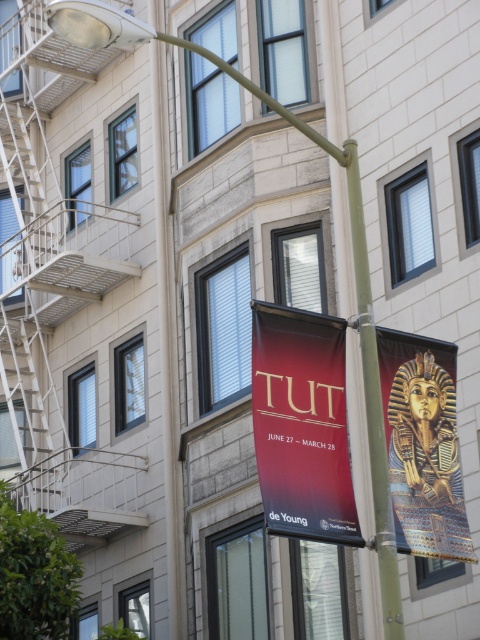
user is a photographer who wants to capture both the matte gold banner at center and the gold metallic pharaoh mask at right in a single frame. Given that the camera can only focus on objects within a 1.5 meter depth range, can the photographer achieve this?

→ The matte gold banner at center is closer to the viewer than the gold metallic pharaoh mask at right. The depth between them is not specified, but since the camera can focus within a 1.5 meter range, it depends on their actual distance. However, based on the given information, there is no indication they exceed this range, so it might be possible if they are within 1.5 meters of each other.